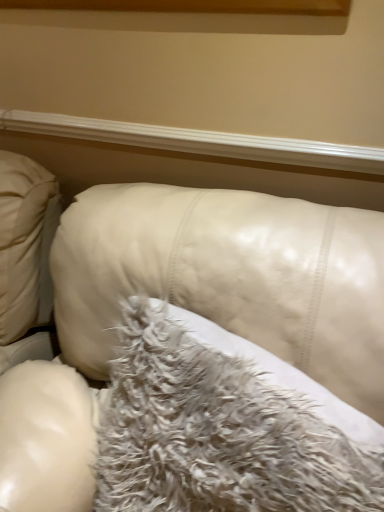
Where is `white leather couch at center`? white leather couch at center is located at coordinates (184, 366).

From the image's perspective, which is below, fuzzy white pillow at center or white leather couch at center?

white leather couch at center, from the image's perspective.

Considering the sizes of fuzzy white pillow at center and white leather couch at center in the image, is fuzzy white pillow at center bigger or smaller than white leather couch at center?

Clearly, fuzzy white pillow at center is smaller in size than white leather couch at center.

Is fuzzy white pillow at center touching white leather couch at center?

Yes.

Does white leather couch at center appear on the left side of fuzzy white pillow at center?

Correct, you'll find white leather couch at center to the left of fuzzy white pillow at center.

Considering the relative sizes of white leather couch at center and fuzzy white pillow at center in the image provided, is white leather couch at center smaller than fuzzy white pillow at center?

Actually, white leather couch at center might be larger than fuzzy white pillow at center.

Is white leather couch at center wider than fuzzy white pillow at center?

Yes.

Between white leather couch at center and fuzzy white pillow at center, which one has less height?

fuzzy white pillow at center is shorter.

From a real-world perspective, is white leather couch at center above or below white glossy wood at upper center?

From a real-world perspective, white leather couch at center is physically below white glossy wood at upper center.

Is point (263, 225) more distant than point (343, 147)?

No.

Is white leather couch at center at the right side of white glossy wood at upper center?

Correct, you'll find white leather couch at center to the right of white glossy wood at upper center.

Could you tell me if white leather couch at center is turned towards white glossy wood at upper center?

No, white leather couch at center is not turned towards white glossy wood at upper center.

From the image's perspective, is fuzzy white pillow at center over white glossy wood at upper center?

No, from the image's perspective, fuzzy white pillow at center is not over white glossy wood at upper center.

In the scene shown: Is fuzzy white pillow at center completely or partially outside of white glossy wood at upper center?

Yes, fuzzy white pillow at center is not within white glossy wood at upper center.

Does point (163, 497) appear closer or farther from the camera than point (13, 120)?

Point (163, 497).

Is fuzzy white pillow at center positioned with its back to white glossy wood at upper center?

Yes, fuzzy white pillow at center is positioned with its back facing white glossy wood at upper center.

From the image's perspective, is white glossy wood at upper center on fuzzy white pillow at center?

Yes, from the image's perspective, white glossy wood at upper center is over fuzzy white pillow at center.

Are white glossy wood at upper center and fuzzy white pillow at center located far from each other?

white glossy wood at upper center is near fuzzy white pillow at center, not far away.

The image size is (384, 512). Find the location of `window sill above the fuzzy white pillow at center (from a real-world perspective)`. window sill above the fuzzy white pillow at center (from a real-world perspective) is located at coordinates (200, 141).

Considering the sizes of objects white glossy wood at upper center and white leather couch at center in the image provided, who is bigger, white glossy wood at upper center or white leather couch at center?

With larger size is white leather couch at center.

Is white glossy wood at upper center at the right side of white leather couch at center?

Incorrect, white glossy wood at upper center is not on the right side of white leather couch at center.

Is white glossy wood at upper center inside or outside of white leather couch at center?

white glossy wood at upper center is spatially situated outside white leather couch at center.

Identify the location of pillow behind the white leather couch at center. point(217,433).

At what (x,y) coordinates should I click in order to perform the action: click on furniture lying below the fuzzy white pillow at center (from the image's perspective). Please return your answer as a coordinate pair (x, y). Looking at the image, I should click on (184, 366).

From the image, which object appears to be nearer to fuzzy white pillow at center, white glossy wood at upper center or white leather couch at center?

white leather couch at center is closer to fuzzy white pillow at center.

Based on their spatial positions, is white glossy wood at upper center or fuzzy white pillow at center closer to white leather couch at center?

Among the two, fuzzy white pillow at center is located nearer to white leather couch at center.

From the image, which object appears to be farther from fuzzy white pillow at center, white leather couch at center or white glossy wood at upper center?

white glossy wood at upper center lies further to fuzzy white pillow at center than the other object.

When comparing their distances from white glossy wood at upper center, does fuzzy white pillow at center or white leather couch at center seem closer?

white leather couch at center is positioned closer to the anchor white glossy wood at upper center.

Which object lies further to the anchor point white leather couch at center, fuzzy white pillow at center or white glossy wood at upper center?

white glossy wood at upper center is further to white leather couch at center.

Looking at the image, which one is located closer to white glossy wood at upper center, white leather couch at center or fuzzy white pillow at center?

Among the two, white leather couch at center is located nearer to white glossy wood at upper center.

At what (x,y) coordinates should I click in order to perform the action: click on pillow between white glossy wood at upper center and white leather couch at center vertically. Please return your answer as a coordinate pair (x, y). This screenshot has width=384, height=512. Looking at the image, I should click on (217, 433).